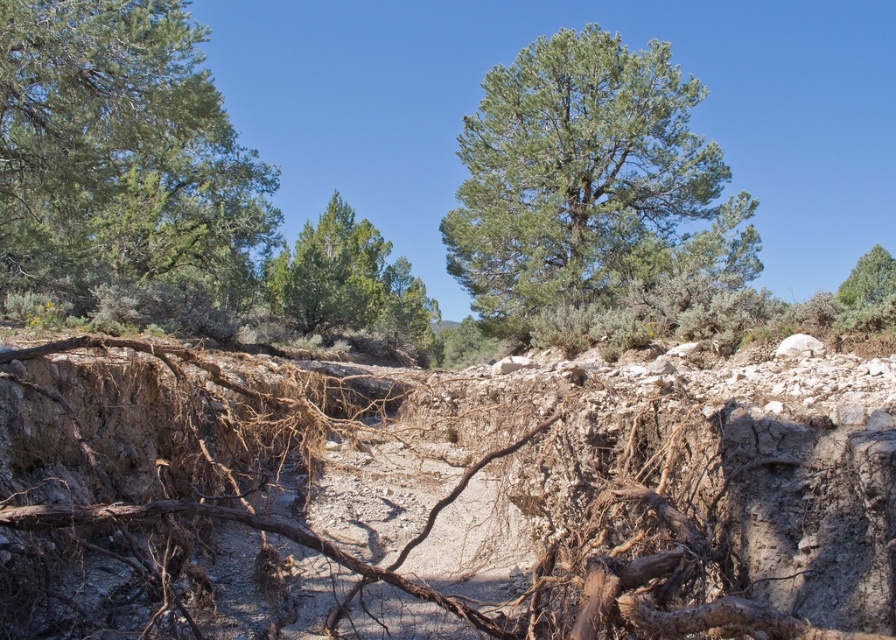
You are standing at the point with coordinates point (59,102) and want to walk towards the point (883,252). Considering the terrain described in the scene, will you have to climb uphill or downhill?

Since point (59,102) is in front of point (883,252), you will have to climb uphill to reach point (883,252) from point (59,102).

You are standing in the rugged landscape and want to walk from the point at coordinates (579, 211) to the point at (276, 280). Based on the terrain described, will you need to walk uphill or downhill?

Point (579, 211) is in front of point (276, 280), so you would be moving towards a closer point from your perspective. However, the terrain details in the scene do not provide elevation information between these specific points. The question cannot be definitively answered with the given data.